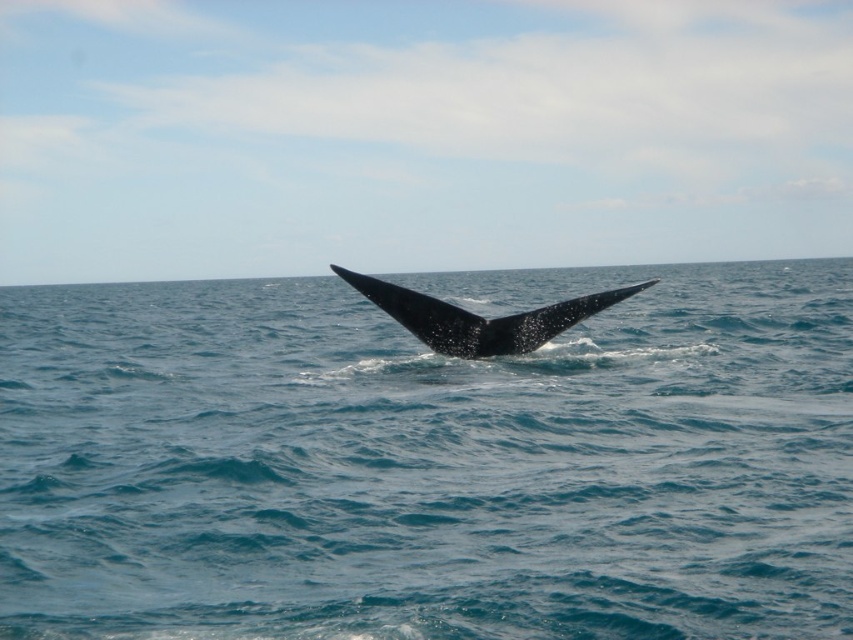
Question: Does glossy blue water at center have a lesser width compared to black matte whale tail at center?

Choices:
 (A) yes
 (B) no

Answer: (B)

Question: Is glossy blue water at center positioned behind black matte whale tail at center?

Choices:
 (A) no
 (B) yes

Answer: (A)

Question: Does glossy blue water at center appear under black matte whale tail at center?

Choices:
 (A) yes
 (B) no

Answer: (B)